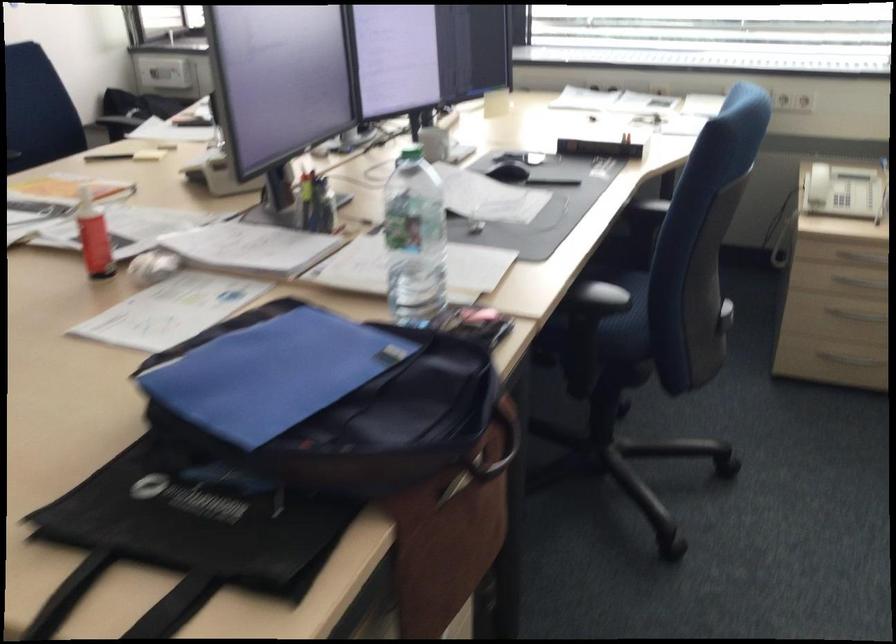
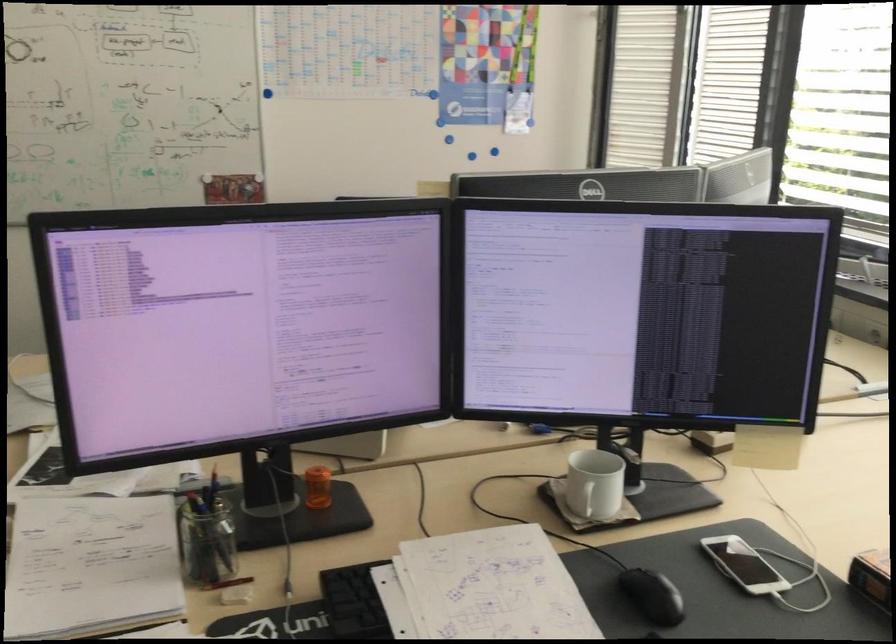
In the second image, find the point that corresponds to (312,205) in the first image.

(205, 538)